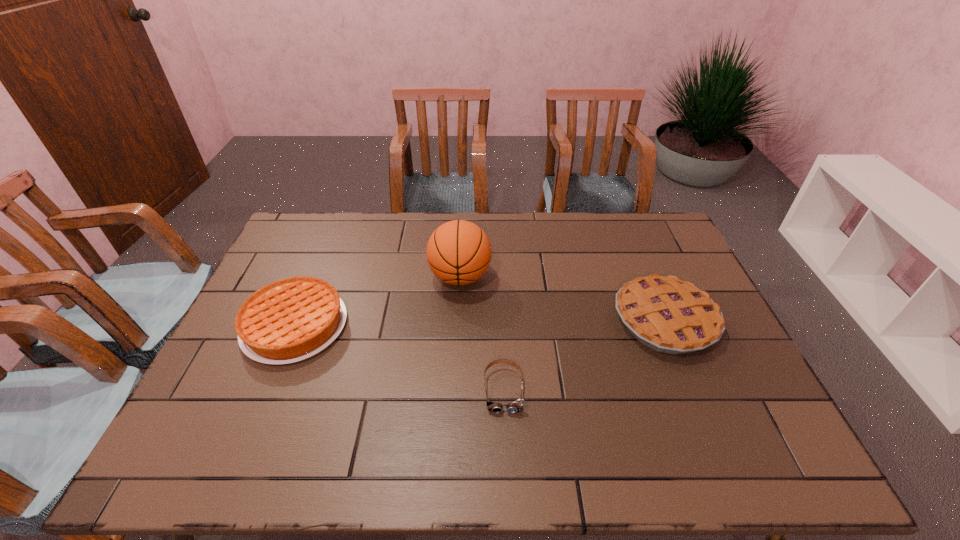
The width and height of the screenshot is (960, 540). Find the location of `free space at the far edge of the desktop`. free space at the far edge of the desktop is located at coordinates (541, 231).

At what (x,y) coordinates should I click in order to perform the action: click on vacant space at the near edge of the desktop. Please return your answer as a coordinate pair (x, y). The image size is (960, 540). Looking at the image, I should click on (372, 468).

This screenshot has width=960, height=540. I want to click on vacant position at the left edge of the desktop, so click(x=273, y=377).

Locate an element on the screen. The width and height of the screenshot is (960, 540). free location at the near left corner is located at coordinates (182, 443).

In the image, there is a desktop. At what (x,y) coordinates should I click in order to perform the action: click on vacant region at the far right corner. Please return your answer as a coordinate pair (x, y). Looking at the image, I should click on (671, 245).

Identify the location of free spot between the tallest object and the left pie. The width and height of the screenshot is (960, 540). (377, 301).

Where is `free space between the right pie and the tallest object`? This screenshot has height=540, width=960. free space between the right pie and the tallest object is located at coordinates (563, 299).

I want to click on free space between the right pie and the goggles, so click(585, 355).

I want to click on unoccupied area between the goggles and the right pie, so click(x=585, y=355).

Identify the location of vacant area that lies between the left pie and the basketball. The height and width of the screenshot is (540, 960). (377, 301).